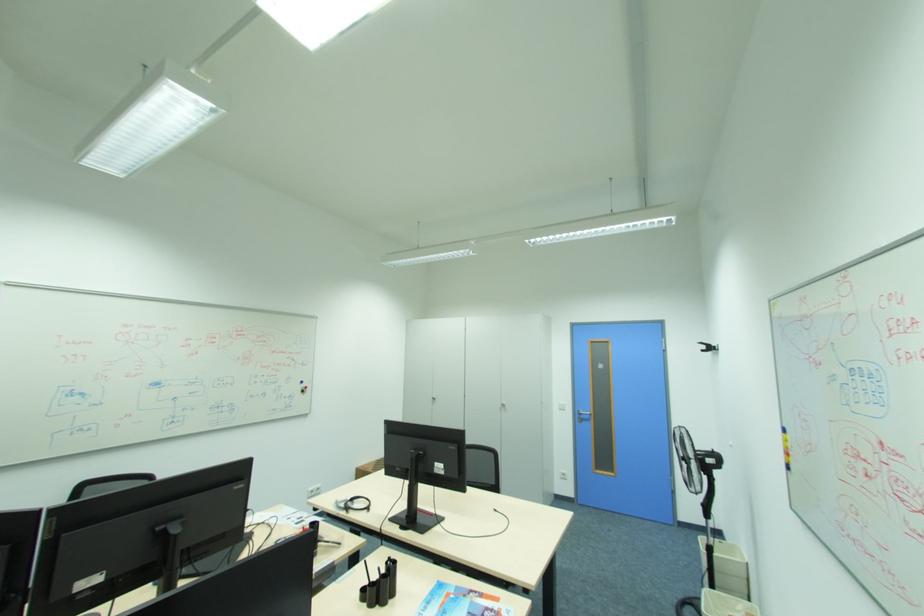
The width and height of the screenshot is (924, 616). Find the location of `black wall hook`. black wall hook is located at coordinates (708, 347).